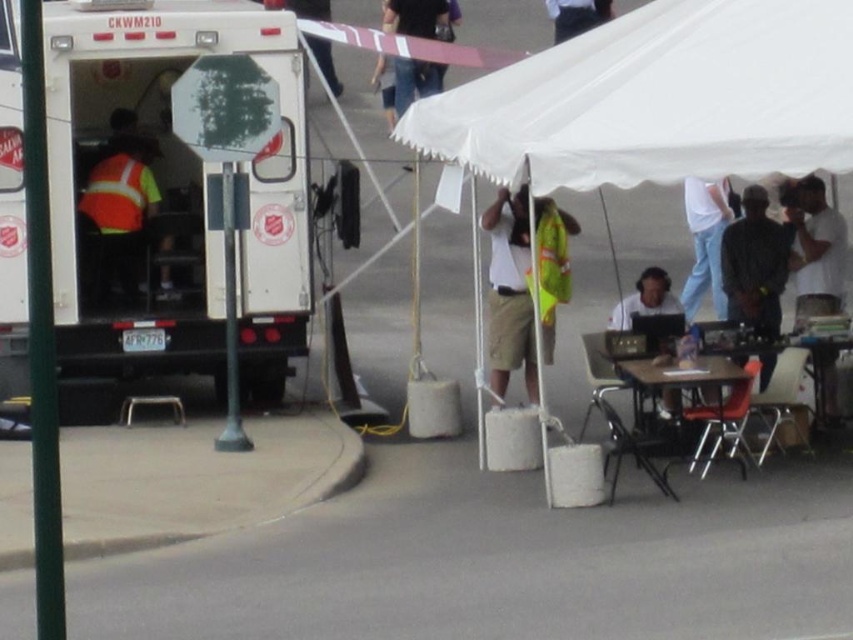
Question: Can you confirm if white fabric canopy at upper center is bigger than matte black laptop at center?

Choices:
 (A) no
 (B) yes

Answer: (B)

Question: Which point is farther from the camera taking this photo?

Choices:
 (A) (685, 172)
 (B) (622, 376)
 (C) (711, 8)
 (D) (126, 204)

Answer: (D)

Question: Can you confirm if white fabric tent at center is bigger than white fabric canopy at upper center?

Choices:
 (A) yes
 (B) no

Answer: (B)

Question: Which of the following is the farthest from the observer?

Choices:
 (A) (97, 225)
 (B) (767, 128)
 (C) (260, 209)
 (D) (519, 358)

Answer: (A)

Question: Considering the relative positions of reflective yellow safety vest at center and wooden table at lower right in the image provided, where is reflective yellow safety vest at center located with respect to wooden table at lower right?

Choices:
 (A) right
 (B) left

Answer: (B)

Question: Which point appears closest to the camera in this image?

Choices:
 (A) (520, 195)
 (B) (635, 451)
 (C) (155, 118)

Answer: (B)